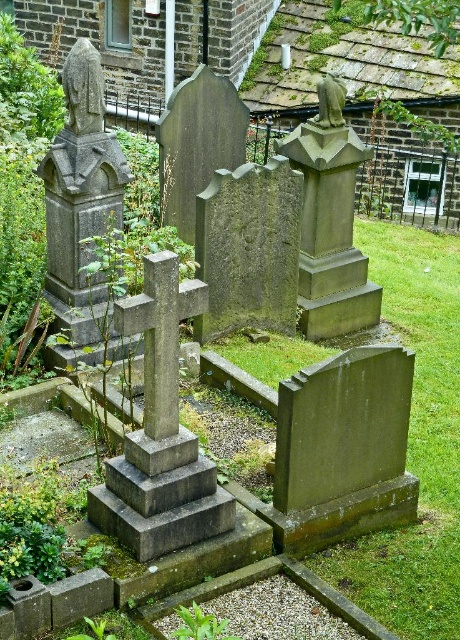
Question: Can you confirm if smooth gray stone statue at upper left is positioned below green stone statue at center?

Choices:
 (A) no
 (B) yes

Answer: (B)

Question: Among these objects, which one is nearest to the camera?

Choices:
 (A) green stone statue at center
 (B) smooth gray stone statue at upper left

Answer: (B)

Question: Among these objects, which one is farthest from the camera?

Choices:
 (A) green stone statue at center
 (B) smooth gray stone statue at upper left

Answer: (A)

Question: Does smooth gray stone statue at upper left appear over green stone statue at center?

Choices:
 (A) no
 (B) yes

Answer: (A)

Question: Which point is farther to the camera?

Choices:
 (A) (315, 122)
 (B) (82, 65)

Answer: (A)

Question: From the image, what is the correct spatial relationship of smooth gray stone statue at upper left in relation to green stone statue at center?

Choices:
 (A) below
 (B) above

Answer: (A)